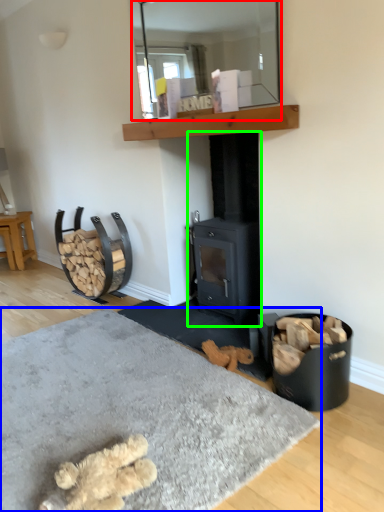
Question: Considering the real-world distances, which object is closest to mirror (highlighted by a red box)? concrete (highlighted by a blue box) or wood burning stove (highlighted by a green box).

Choices:
 (A) concrete
 (B) wood burning stove

Answer: (B)